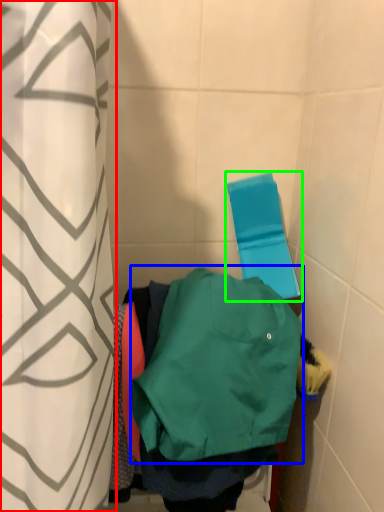
Question: Which object is the farthest from curtain (highlighted by a red box)? Choose among these: sweatshirt (highlighted by a blue box) or beach towel (highlighted by a green box).

Choices:
 (A) sweatshirt
 (B) beach towel

Answer: (B)